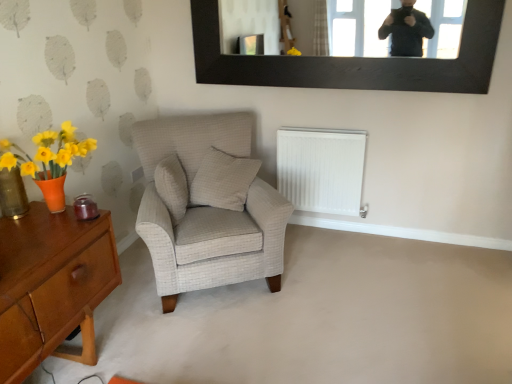
Question: Is wooden desk at lower left spatially inside white plastic radiator at lower center, or outside of it?

Choices:
 (A) outside
 (B) inside

Answer: (A)

Question: Is wooden desk at lower left bigger or smaller than white plastic radiator at lower center?

Choices:
 (A) small
 (B) big

Answer: (B)

Question: Which object is positioned closest to the wooden desk at lower left?

Choices:
 (A) light gray fabric armchair at center
 (B) beige textured pillow at center, which is the 2th pillow in right-to-left order
 (C) black wood picture frame at upper center
 (D) translucent amber glass vase at left
 (E) white checkered pillow at center, the 2th pillow viewed from the left

Answer: (D)

Question: Based on their relative distances, which object is farther from the wooden desk at lower left?

Choices:
 (A) white checkered pillow at center, which is the 1th pillow from right to left
 (B) beige textured pillow at center, which is the 2th pillow in right-to-left order
 (C) light gray fabric armchair at center
 (D) translucent amber glass vase at left
 (E) white plastic radiator at lower center

Answer: (E)